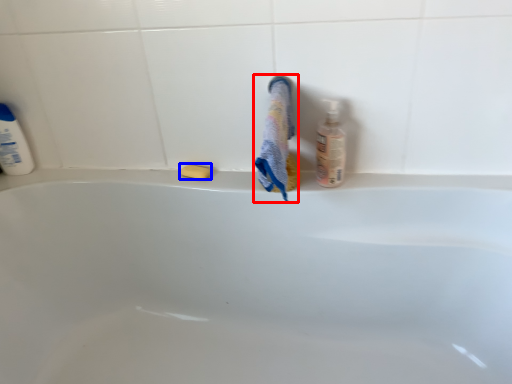
Question: Which of the following is the closest to the observer, bath towel (highlighted by a red box) or soap (highlighted by a blue box)?

Choices:
 (A) bath towel
 (B) soap

Answer: (A)